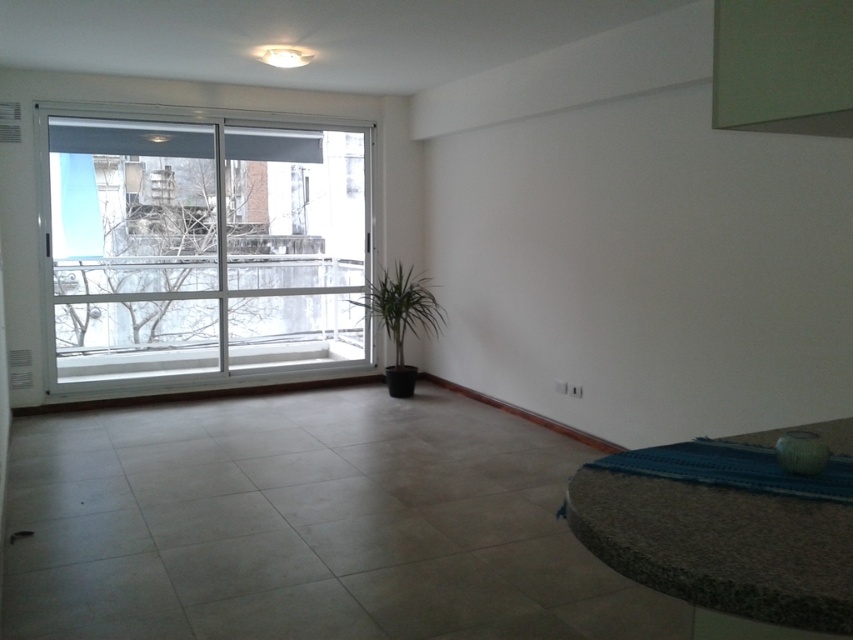
Question: Which object appears farthest from the camera in this image?

Choices:
 (A) green matte plant at center
 (B) white plastic window at left

Answer: (A)

Question: Which point is farther to the camera?

Choices:
 (A) (277, 257)
 (B) (410, 312)

Answer: (A)

Question: In this image, where is white plastic window at left located relative to green matte plant at center?

Choices:
 (A) below
 (B) above

Answer: (B)

Question: Is white plastic window at left below green matte plant at center?

Choices:
 (A) yes
 (B) no

Answer: (B)

Question: Can you confirm if white plastic window at left is positioned below green matte plant at center?

Choices:
 (A) yes
 (B) no

Answer: (B)